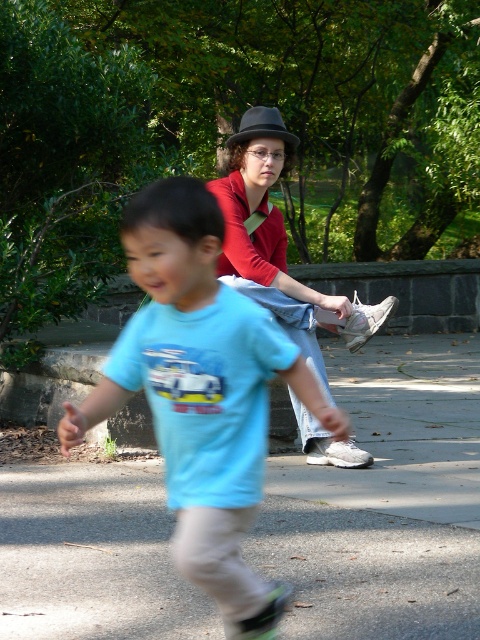
Is point (200, 515) in front of point (252, 161)?

Yes, it is in front of point (252, 161).

Is light blue t-shirt at center behind matte red shirt at center?

No.

Is point (197, 268) in front of point (280, 276)?

Yes, point (197, 268) is in front of point (280, 276).

This screenshot has height=640, width=480. Identify the location of light blue t-shirt at center. (202, 394).

Between matte red shirt at center and black felt hat at upper center, which one has less height?

Standing shorter between the two is black felt hat at upper center.

Is matte red shirt at center to the left of black felt hat at upper center from the viewer's perspective?

In fact, matte red shirt at center is to the right of black felt hat at upper center.

Is point (283, 248) closer to camera compared to point (279, 134)?

No.

Find the location of `matte red shirt at center`. matte red shirt at center is located at coordinates (280, 257).

Is light blue t-shirt at center smaller than black felt hat at upper center?

Incorrect, light blue t-shirt at center is not smaller in size than black felt hat at upper center.

Which is above, light blue t-shirt at center or black felt hat at upper center?

black felt hat at upper center is higher up.

Is point (178, 284) less distant than point (240, 134)?

Yes, point (178, 284) is in front of point (240, 134).

The image size is (480, 640). Find the location of `light blue t-shirt at center`. light blue t-shirt at center is located at coordinates [202, 394].